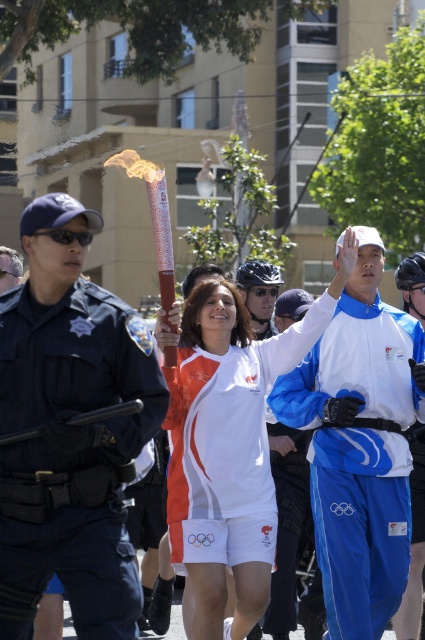
Question: Which object is positioned farthest from the blue uniformed officer at left?

Choices:
 (A) black uniform at left
 (B) white fabric shirt at center
 (C) blue synthetic jacket at center
 (D) shiny metallic torch at center

Answer: (A)

Question: Does shiny metallic torch at center have a larger size compared to blue uniformed officer at left?

Choices:
 (A) no
 (B) yes

Answer: (B)

Question: In this image, where is blue synthetic jacket at center located relative to white fabric shirt at center?

Choices:
 (A) right
 (B) left

Answer: (A)

Question: Can you confirm if blue uniformed officer at left is positioned to the right of blue synthetic jacket at center?

Choices:
 (A) no
 (B) yes

Answer: (A)

Question: Estimate the real-world distances between objects in this image. Which object is closer to the shiny metallic torch at center?

Choices:
 (A) blue uniformed officer at left
 (B) black uniform at left
 (C) white fabric shirt at center
 (D) blue synthetic jacket at center

Answer: (A)

Question: Which point is closer to the camera?

Choices:
 (A) coord(308,332)
 (B) coord(8,268)
 (C) coord(56,376)
 (D) coord(336,557)

Answer: (C)